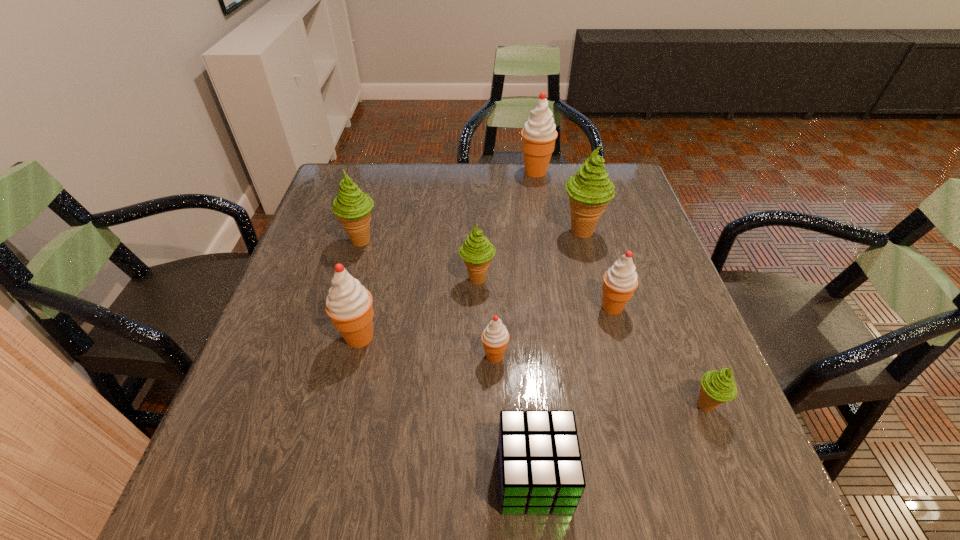
Locate an element on the screen. object that is the seventh closest to the leftmost red icecream is located at coordinates (717, 386).

Locate which object is the fifth closest to the fourth nearest icecream. Please provide its 2D coordinates. Your answer should be formatted as a tuple, i.e. [(x, y)], where the tuple contains the x and y coordinates of a point satisfying the conditions above.

[(540, 469)]

Locate which icecream ranks fourth in proximity to the second biggest red icecream. Please provide its 2D coordinates. Your answer should be formatted as a tuple, i.e. [(x, y)], where the tuple contains the x and y coordinates of a point satisfying the conditions above.

[(620, 281)]

Identify the location of the fourth closest icecream relative to the third biggest green icecream. The height and width of the screenshot is (540, 960). (352, 207).

Image resolution: width=960 pixels, height=540 pixels. What are the coordinates of `the fourth closest red icecream to the third green icecream from left to right` in the screenshot? It's located at (349, 304).

At what (x,y) coordinates should I click in order to perform the action: click on the third closest red icecream to the third red icecream from right to left. Please return your answer as a coordinate pair (x, y). The image size is (960, 540). Looking at the image, I should click on (539, 133).

Identify which green icecream is located as the nearest to the fifth nearest icecream. Please provide its 2D coordinates. Your answer should be formatted as a tuple, i.e. [(x, y)], where the tuple contains the x and y coordinates of a point satisfying the conditions above.

[(590, 190)]

This screenshot has height=540, width=960. In order to click on green icecream that is the closest one to the smallest red icecream in this screenshot , I will do `click(477, 251)`.

Locate an element on the screen. This screenshot has width=960, height=540. vacant space that satisfies the following two spatial constraints: 1. on the front side of the leftmost green icecream; 2. on the left side of the rightmost green icecream is located at coordinates (314, 406).